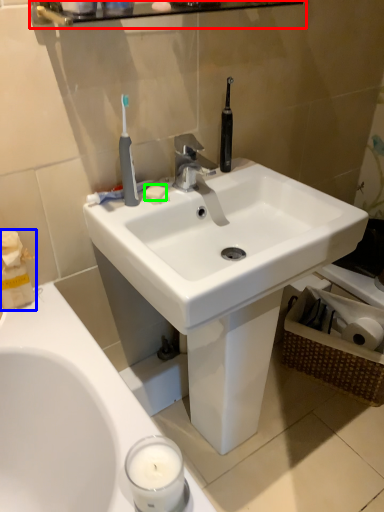
Question: Based on their relative distances, which object is farther from balustrade (highlighted by a red box)? Choose from tissue (highlighted by a blue box) and soap (highlighted by a green box).

Choices:
 (A) tissue
 (B) soap

Answer: (A)